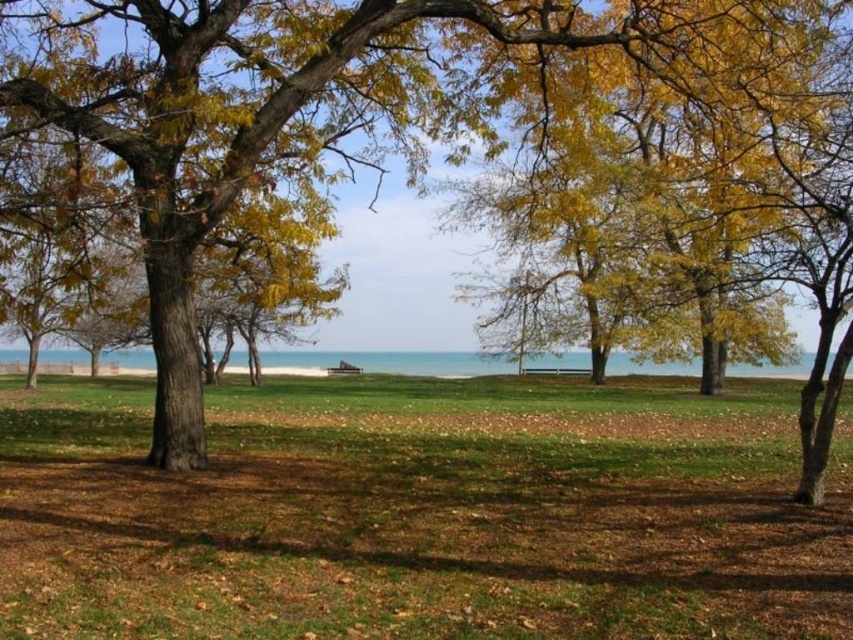
You are planning to take a photo of the yellow leafy tree at center and the blue water at center. Since you want both to be in focus, which object should you focus on to ensure the other is also sharp?

You should focus on the yellow leafy tree at center because it is closer to you than the blue water at center, ensuring both are in focus.

You are planning to take a photo of the blue water at center and the yellow leafy tree at center from the left side of the scene. Which object will appear closer to the left edge of your photo?

The blue water at center will appear closer to the left edge of the photo because the yellow leafy tree at center is positioned on the right side of it.